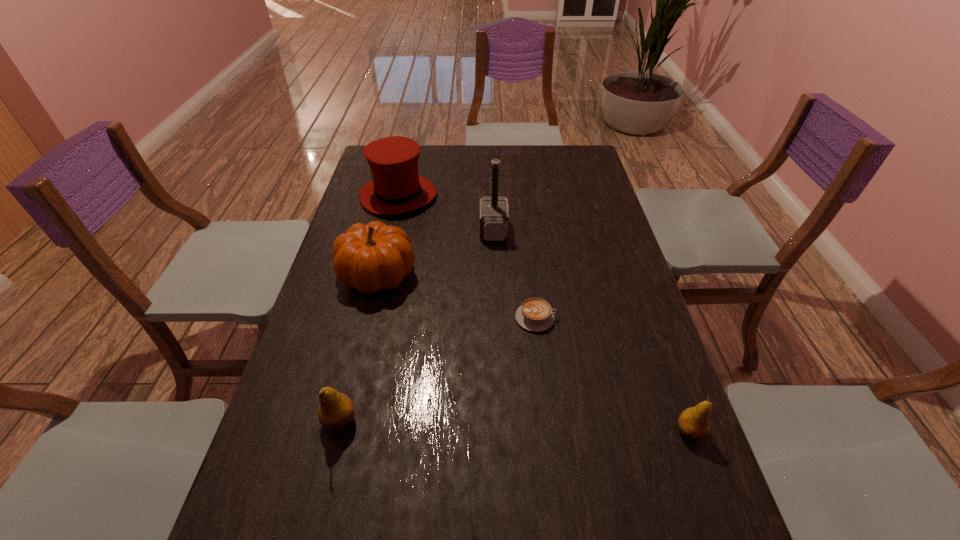
Please point a spot to place another pear for symmetrical spacing. Please provide its 2D coordinates. Your answer should be formatted as a tuple, i.e. [(x, y)], where the tuple contains the x and y coordinates of a point satisfying the conditions above.

[(513, 426)]